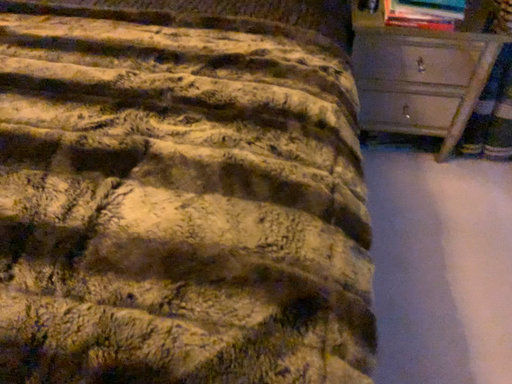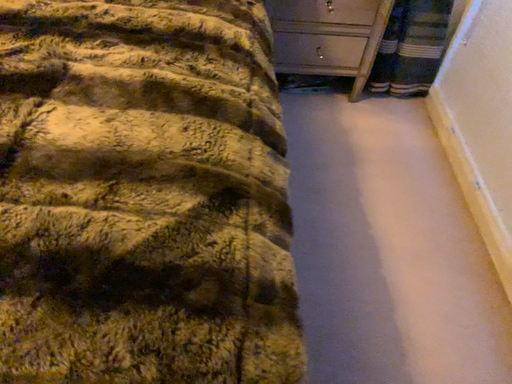
Question: How did the camera likely rotate when shooting the video?

Choices:
 (A) rotated right
 (B) rotated left

Answer: (A)